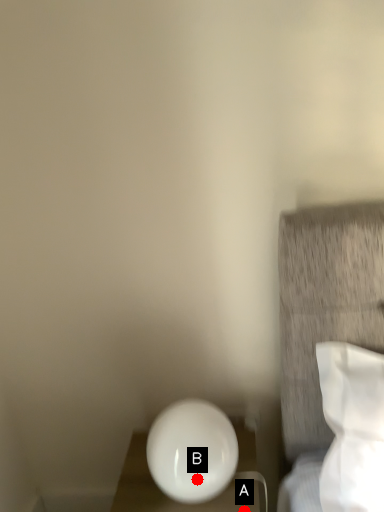
Question: Two points are circled on the image, labeled by A and B beside each circle. Which point is closer to the camera?

Choices:
 (A) A is closer
 (B) B is closer

Answer: (B)